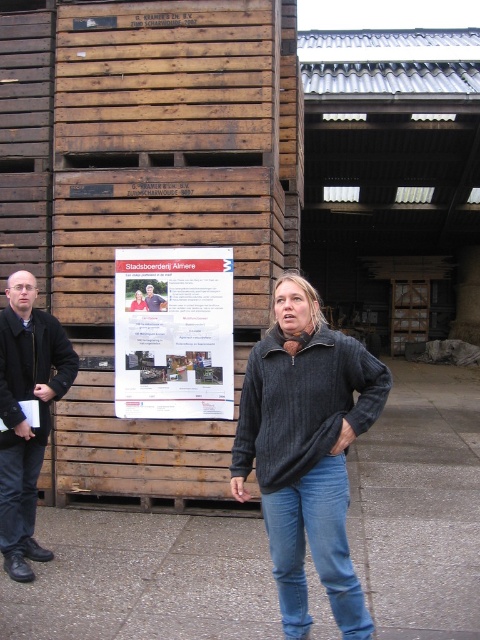
You are trying to decide which item to take for a cold day. The black wool coat at left and the matte black shirt at center are both available. Based on their sizes, which one would provide more warmth?

The black wool coat at left is wider than the matte black shirt at center, so it likely provides more warmth due to its larger size and material.

You are a photographer trying to capture a photo of both the man and the woman in the scene. You notice two points marked in the image at coordinates point [35,352] and point [158,308]. Which point should you focus on first to ensure both subjects are in sharp focus?

You should focus on point [35,352] first because it is closer to the viewer than point [158,308], ensuring both subjects are in focus when using a camera with a fixed focus distance.

You are a fashion designer observing two people in an outdoor setting. You notice a black wool coat at left and blue denim jeans at center. Which clothing item is located more to the left?

The black wool coat at left is more to the left than the blue denim jeans at center.